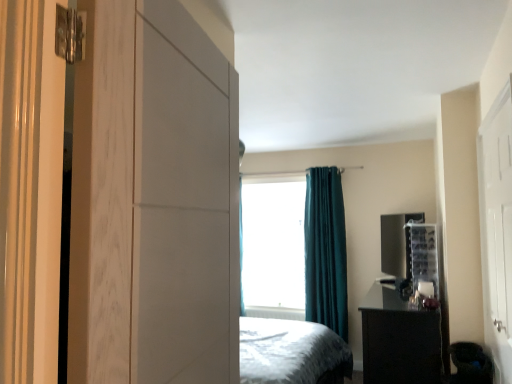
Question: From the image's perspective, is white glossy door at right positioned above or below white matte cabinet at left?

Choices:
 (A) below
 (B) above

Answer: (A)

Question: Is white glossy door at right bigger or smaller than white matte cabinet at left?

Choices:
 (A) small
 (B) big

Answer: (A)

Question: Which of these objects is positioned farthest from the transparent plastic window screen at center?

Choices:
 (A) white matte cabinet at left
 (B) white glossy door at right
 (C) black glossy nightstand at lower right
 (D) teal velvet curtain at center

Answer: (A)

Question: Estimate the real-world distances between objects in this image. Which object is farther from the black glossy nightstand at lower right?

Choices:
 (A) white matte cabinet at left
 (B) teal velvet curtain at center
 (C) transparent plastic window screen at center
 (D) white glossy door at right

Answer: (A)